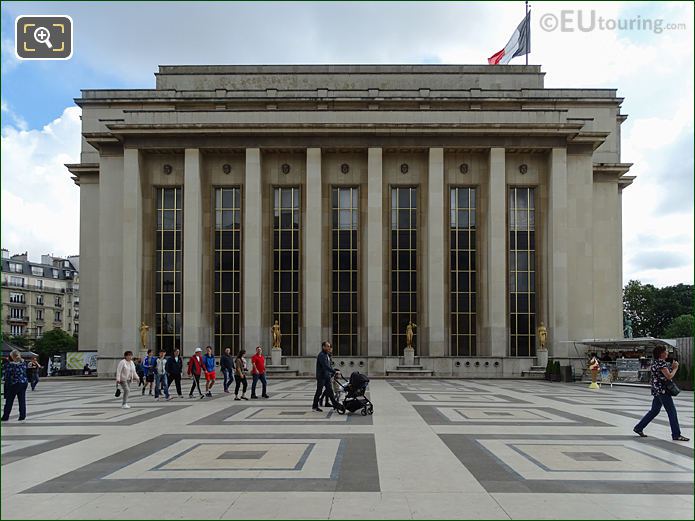
This screenshot has height=521, width=695. I want to click on window, so click(x=165, y=299).